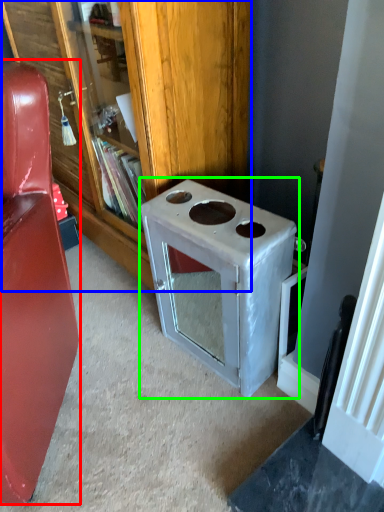
Question: Which object is positioned closest to furniture (highlighted by a red box)? Select from bookcase (highlighted by a blue box) and appliance (highlighted by a green box).

Choices:
 (A) bookcase
 (B) appliance

Answer: (B)